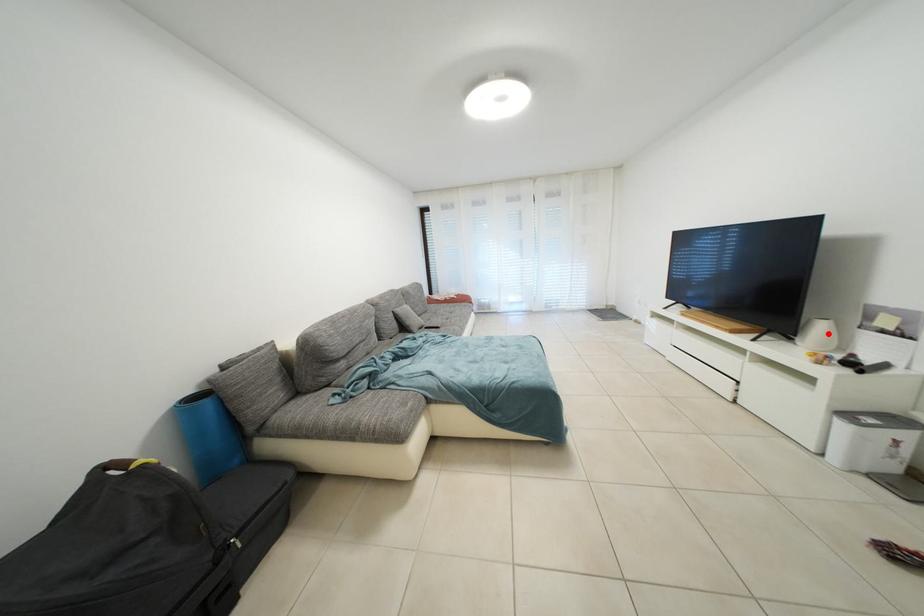
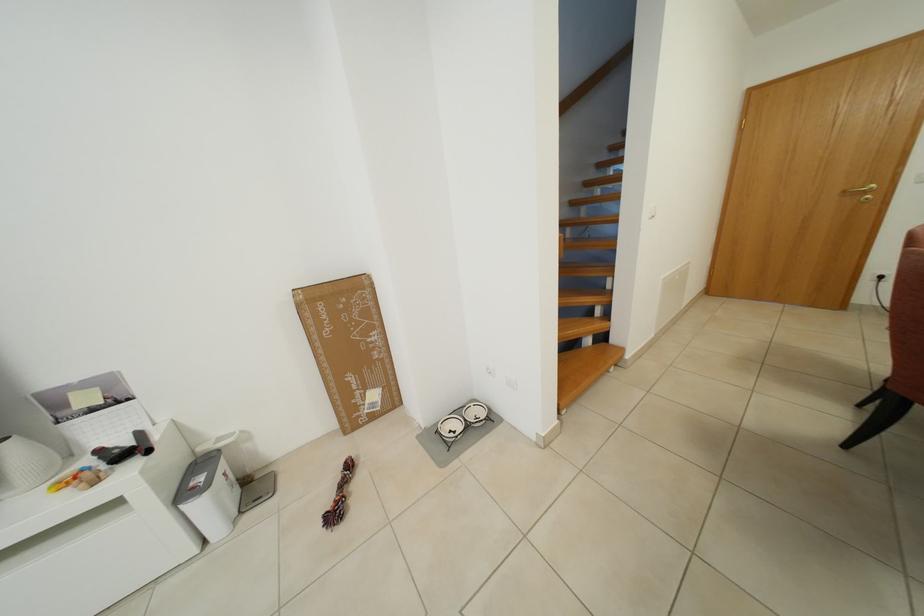
Question: I am providing you with two images of the same scene from different viewpoints. A red point is shown in image1. For the corresponding object point in image2, is it positioned nearer or farther from the camera?

Choices:
 (A) Nearer
 (B) Farther

Answer: (A)